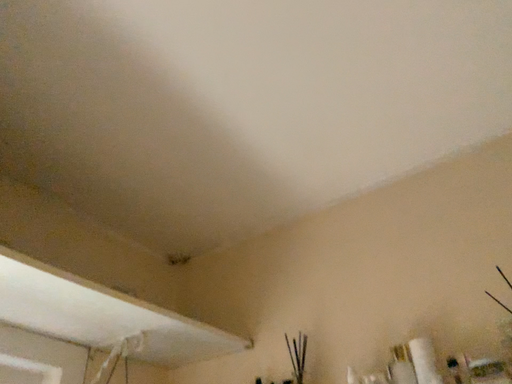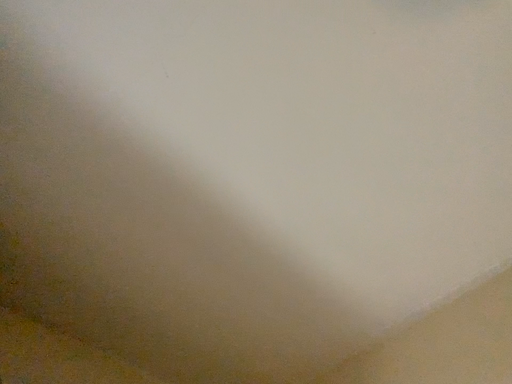
Question: Which way did the camera rotate in the video?

Choices:
 (A) rotated upward
 (B) rotated downward

Answer: (A)